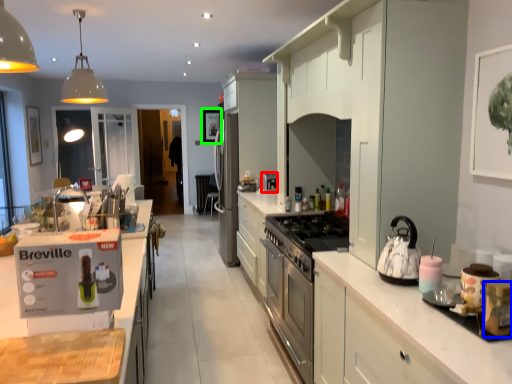
Question: Which object is positioned farthest from coffee machine (highlighted by a red box)? Select from appliance (highlighted by a blue box) and picture frame (highlighted by a green box).

Choices:
 (A) appliance
 (B) picture frame

Answer: (B)